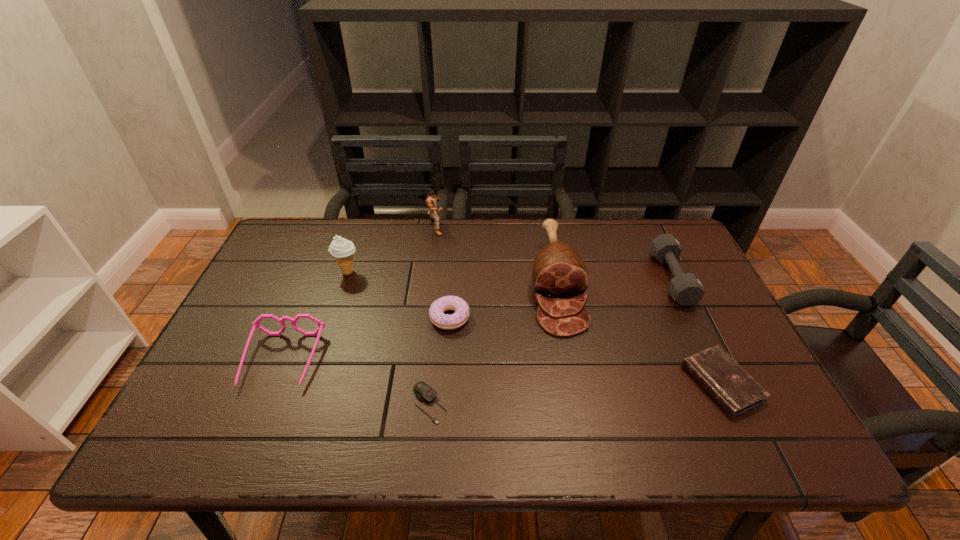
Find the location of `vacant area that lies between the doughnut and the diary`. vacant area that lies between the doughnut and the diary is located at coordinates (586, 350).

Select which object appears as the seventh closest to the puncher. Please provide its 2D coordinates. Your answer should be formatted as a tuple, i.e. [(x, y)], where the tuple contains the x and y coordinates of a point satisfying the conditions above.

[(735, 391)]

This screenshot has width=960, height=540. In order to click on object that is the fourth closest to the farthest object in this screenshot , I will do `click(256, 324)`.

The width and height of the screenshot is (960, 540). I want to click on vacant space that satisfies the following two spatial constraints: 1. on the arms of the shortest object; 2. on the left side of the spectacles, so click(x=265, y=404).

Identify the location of vacant area that satisfies the following two spatial constraints: 1. on the back side of the diary; 2. on the right side of the dumbbell. The image size is (960, 540). (671, 278).

Where is `free space that satisfies the following two spatial constraints: 1. on the arms of the mouse; 2. on the right side of the spectacles`? free space that satisfies the following two spatial constraints: 1. on the arms of the mouse; 2. on the right side of the spectacles is located at coordinates (265, 404).

At what (x,y) coordinates should I click in order to perform the action: click on vacant space that satisfies the following two spatial constraints: 1. on the back side of the dumbbell; 2. on the left side of the mouse. Please return your answer as a coordinate pair (x, y). Looking at the image, I should click on (442, 278).

At what (x,y) coordinates should I click in order to perform the action: click on vacant space that satisfies the following two spatial constraints: 1. on the front-facing side of the farthest object; 2. on the left side of the dumbbell. Please return your answer as a coordinate pair (x, y). Image resolution: width=960 pixels, height=540 pixels. Looking at the image, I should click on click(x=430, y=278).